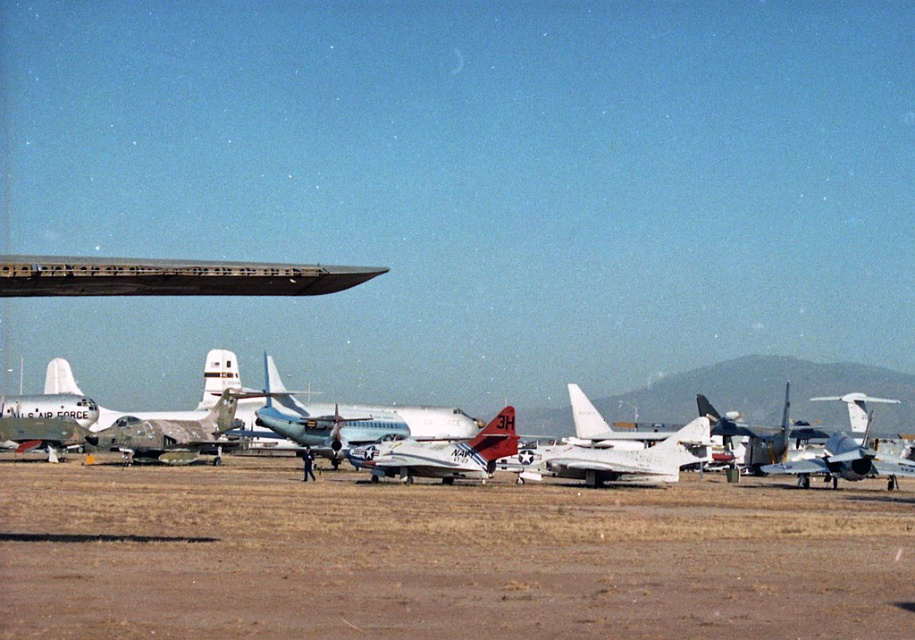
Can you confirm if brown dirt field at center is positioned above silver metallic airplane at center?

Correct, brown dirt field at center is located above silver metallic airplane at center.

Between brown dirt field at center and silver metallic airplane at center, which one has less height?

brown dirt field at center is shorter.

Where is `brown dirt field at center`? The image size is (915, 640). brown dirt field at center is located at coordinates (442, 557).

Where is `brown dirt field at center`? Image resolution: width=915 pixels, height=640 pixels. brown dirt field at center is located at coordinates (442, 557).